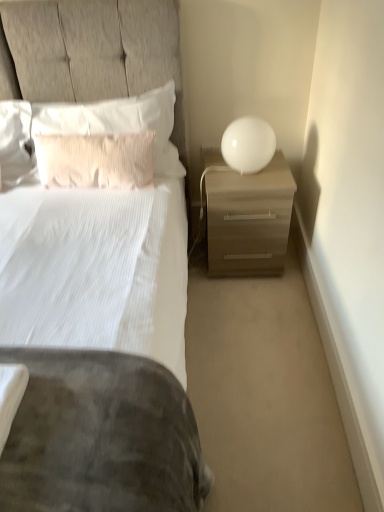
Question: Does matte wood nightstand at right have a larger size compared to white textured pillow at upper left, positioned as the first pillow in top-to-bottom order?

Choices:
 (A) no
 (B) yes

Answer: (B)

Question: From the image's perspective, is matte wood nightstand at right located above white textured pillow at upper left, positioned as the first pillow in top-to-bottom order?

Choices:
 (A) no
 (B) yes

Answer: (A)

Question: Is matte wood nightstand at right oriented away from white textured pillow at upper left, positioned as the first pillow in top-to-bottom order?

Choices:
 (A) no
 (B) yes

Answer: (A)

Question: From the image's perspective, is matte wood nightstand at right under white textured pillow at upper left, positioned as the second pillow in bottom-to-top order?

Choices:
 (A) yes
 (B) no

Answer: (A)

Question: Can white textured pillow at upper left, positioned as the first pillow in top-to-bottom order, be found inside matte wood nightstand at right?

Choices:
 (A) yes
 (B) no

Answer: (B)

Question: Is pink textured pillow at upper left, which ranks as the first pillow in bottom-to-top order, to the left or to the right of matte wood nightstand at right in the image?

Choices:
 (A) left
 (B) right

Answer: (A)

Question: Is pink textured pillow at upper left, which ranks as the first pillow in bottom-to-top order, in front of or behind matte wood nightstand at right in the image?

Choices:
 (A) front
 (B) behind

Answer: (A)

Question: Would you say pink textured pillow at upper left, which ranks as the first pillow in bottom-to-top order, is inside or outside matte wood nightstand at right?

Choices:
 (A) outside
 (B) inside

Answer: (A)

Question: Considering the positions of pink textured pillow at upper left, which is the second pillow in top-to-bottom order, and matte wood nightstand at right in the image, is pink textured pillow at upper left, which is the second pillow in top-to-bottom order, bigger or smaller than matte wood nightstand at right?

Choices:
 (A) small
 (B) big

Answer: (A)

Question: Considering their positions, is white glossy sphere at upper right located in front of or behind white textured pillow at upper left, positioned as the first pillow in top-to-bottom order?

Choices:
 (A) behind
 (B) front

Answer: (B)

Question: Is white glossy sphere at upper right inside the boundaries of white textured pillow at upper left, positioned as the first pillow in top-to-bottom order, or outside?

Choices:
 (A) inside
 (B) outside

Answer: (B)

Question: Would you say white glossy sphere at upper right is to the left or to the right of white textured pillow at upper left, positioned as the first pillow in top-to-bottom order, in the picture?

Choices:
 (A) right
 (B) left

Answer: (A)

Question: From the image's perspective, is white glossy sphere at upper right located above or below white textured pillow at upper left, positioned as the first pillow in top-to-bottom order?

Choices:
 (A) below
 (B) above

Answer: (A)

Question: Considering the positions of point (59, 122) and point (39, 150), is point (59, 122) closer or farther from the camera than point (39, 150)?

Choices:
 (A) closer
 (B) farther

Answer: (B)

Question: From the image's perspective, relative to pink textured pillow at upper left, which ranks as the first pillow in bottom-to-top order, is white textured pillow at upper left, positioned as the first pillow in top-to-bottom order, above or below?

Choices:
 (A) below
 (B) above

Answer: (B)